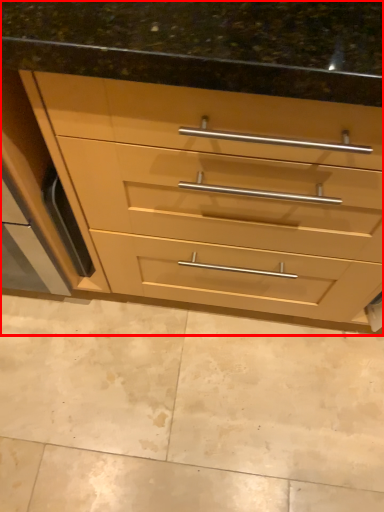
Question: Observing the image, what is the correct spatial positioning of chest of drawers (annotated by the red box) in reference to granite?

Choices:
 (A) left
 (B) right

Answer: (B)